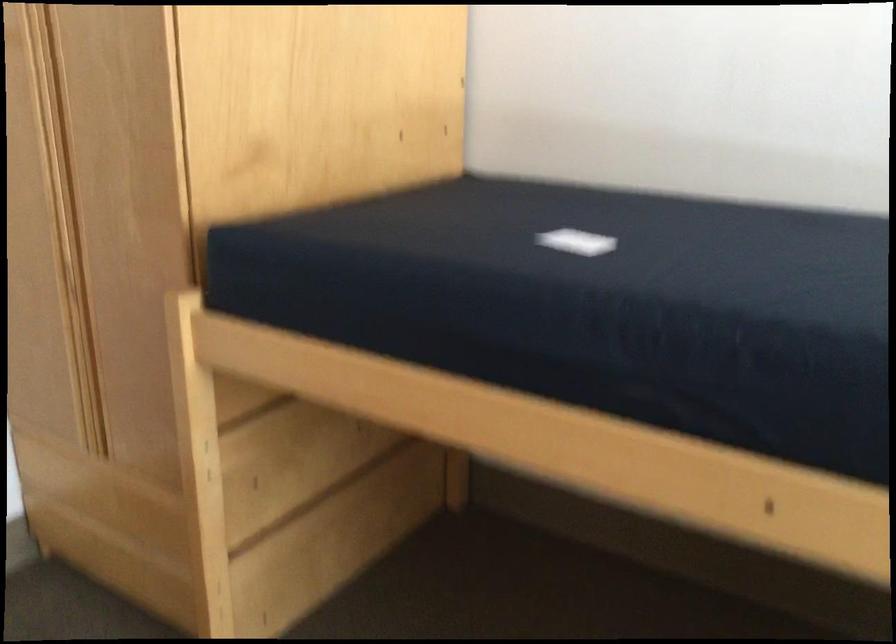
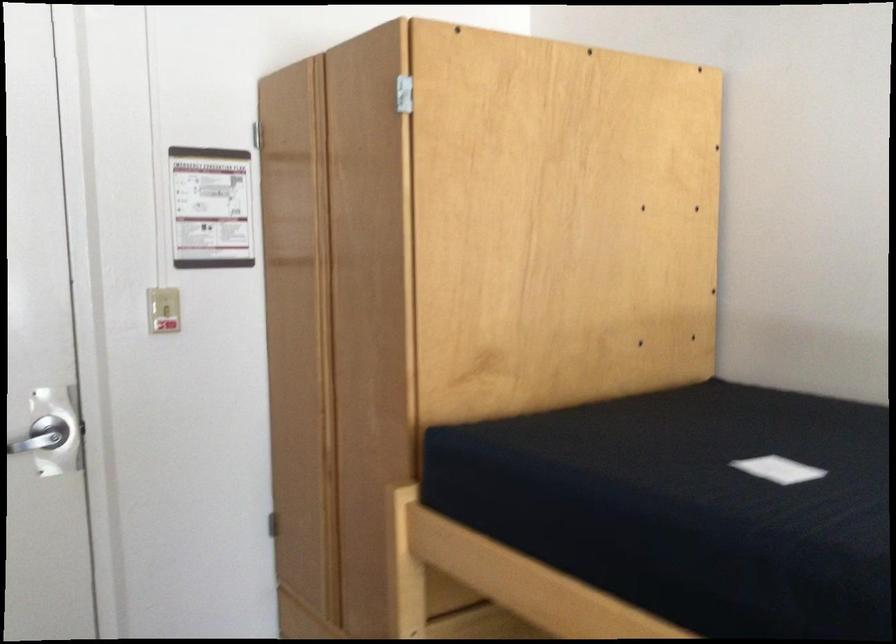
Locate, in the second image, the point that corresponds to point 565,241 in the first image.

(778, 469)